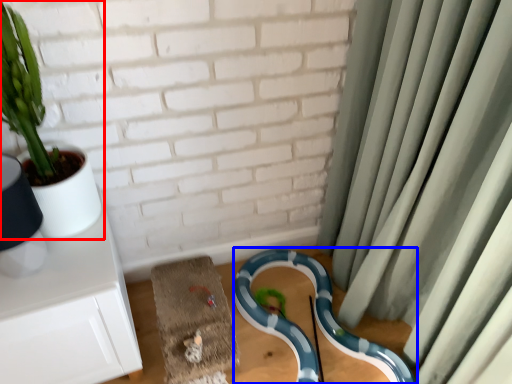
Question: Which point is closer to the camera, houseplant (highlighted by a red box) or snake (highlighted by a blue box)?

Choices:
 (A) houseplant
 (B) snake

Answer: (A)